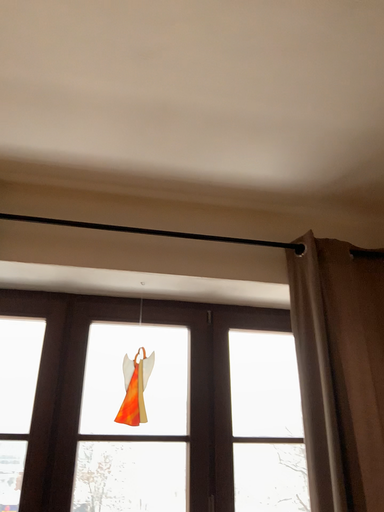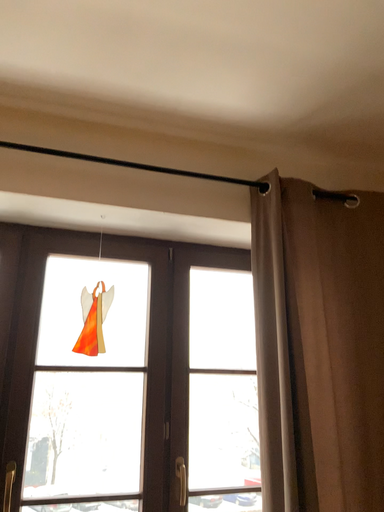
Question: How did the camera likely rotate when shooting the video?

Choices:
 (A) rotated upward
 (B) rotated downward

Answer: (B)